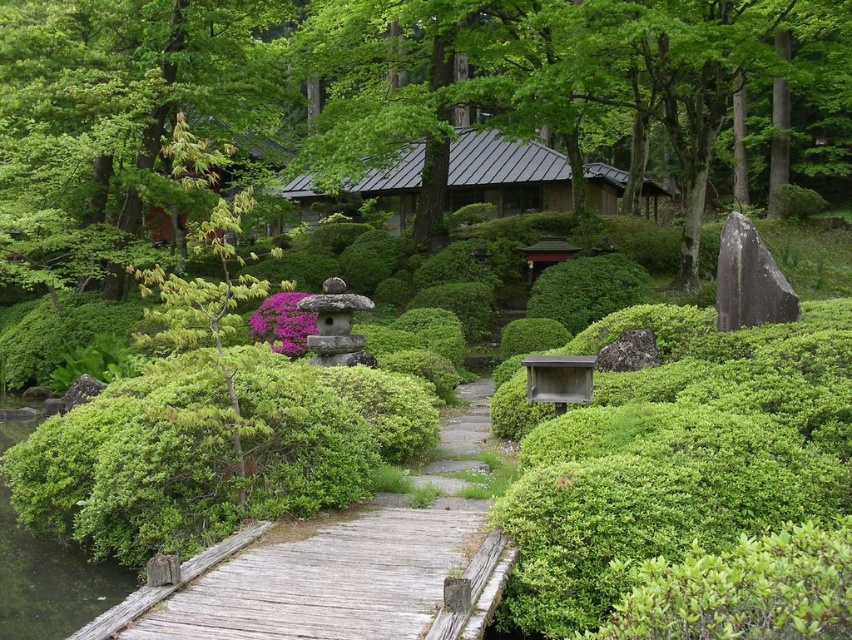
Is point (222, 40) in front of point (68, 106)?

No, it is not.

This screenshot has height=640, width=852. What do you see at coordinates (412, 77) in the screenshot?
I see `green leafy tree at upper center` at bounding box center [412, 77].

What do you see at coordinates (412, 77) in the screenshot? Image resolution: width=852 pixels, height=640 pixels. I see `green leafy tree at upper center` at bounding box center [412, 77].

You are a GUI agent. You are given a task and a screenshot of the screen. Output one action in this format:
    pyautogui.click(x=<x>, y=<y>)
    Task: Click on the green leafy tree at upper center
    The image size is (852, 640).
    Given the screenshot: What is the action you would take?
    pyautogui.click(x=412, y=77)

Consider the image. Who is taller, green leafy bush at right or green leafy tree at upper left?

green leafy bush at right

Is point (677, 333) closer to camera compared to point (18, 32)?

Yes, point (677, 333) is closer to viewer.

You are a GUI agent. You are given a task and a screenshot of the screen. Output one action in this format:
    pyautogui.click(x=<x>, y=<y>)
    Task: Click on the green leafy bush at right
    Image resolution: width=852 pixels, height=640 pixels.
    Given the screenshot: What is the action you would take?
    pyautogui.click(x=671, y=452)

Which is behind, point (513, 611) or point (296, 588)?

Point (513, 611)

Describe the element at coordinates (671, 452) in the screenshot. I see `green leafy bush at right` at that location.

Image resolution: width=852 pixels, height=640 pixels. What are the coordinates of `green leafy bush at right` in the screenshot? It's located at (671, 452).